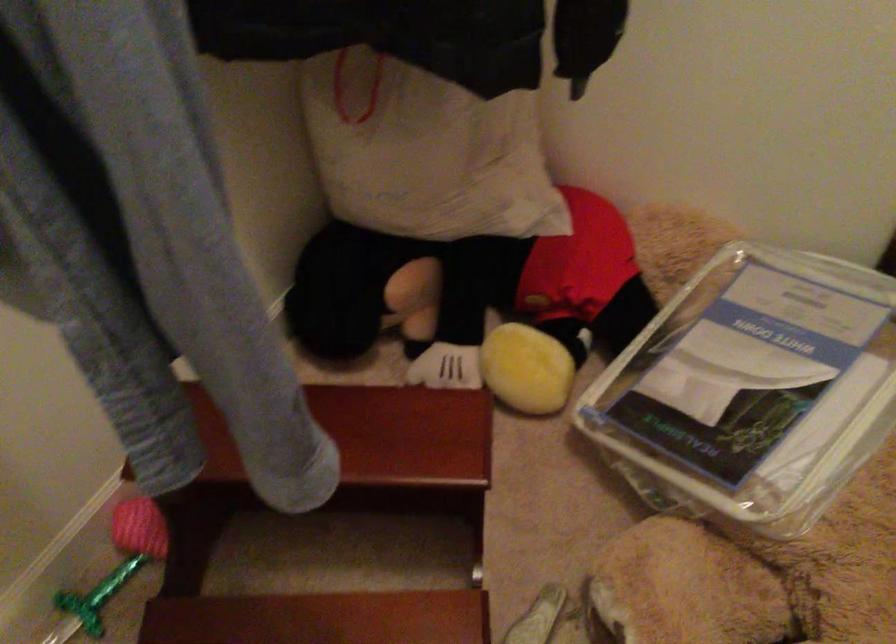
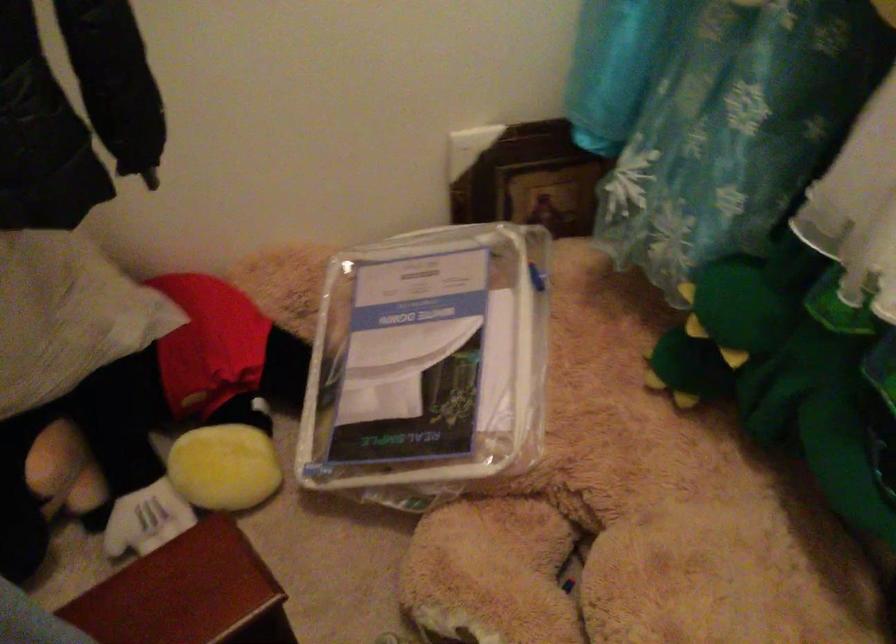
Question: The first image is from the beginning of the video and the second image is from the end. How did the camera likely rotate when shooting the video?

Choices:
 (A) Left
 (B) Right
 (C) Up
 (D) Down

Answer: (B)